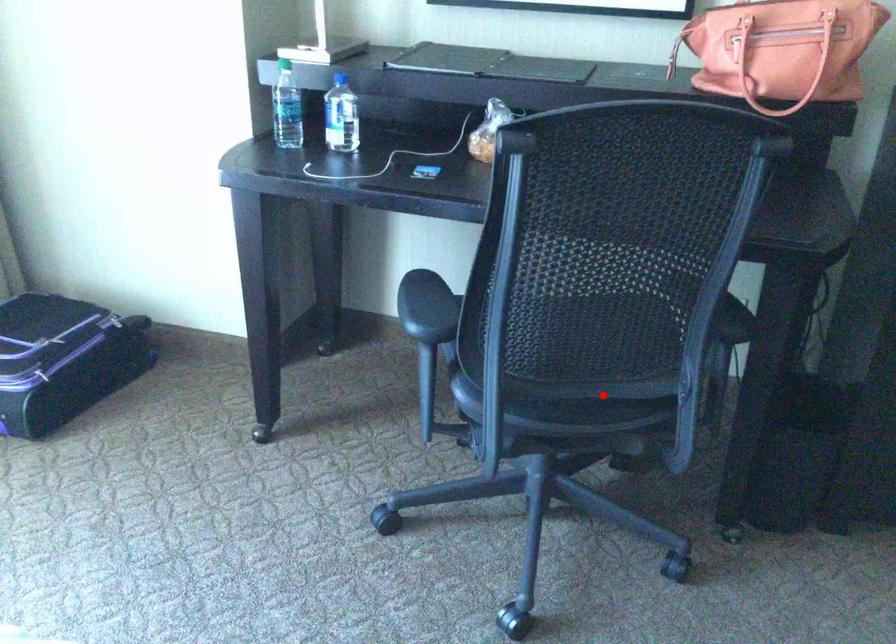
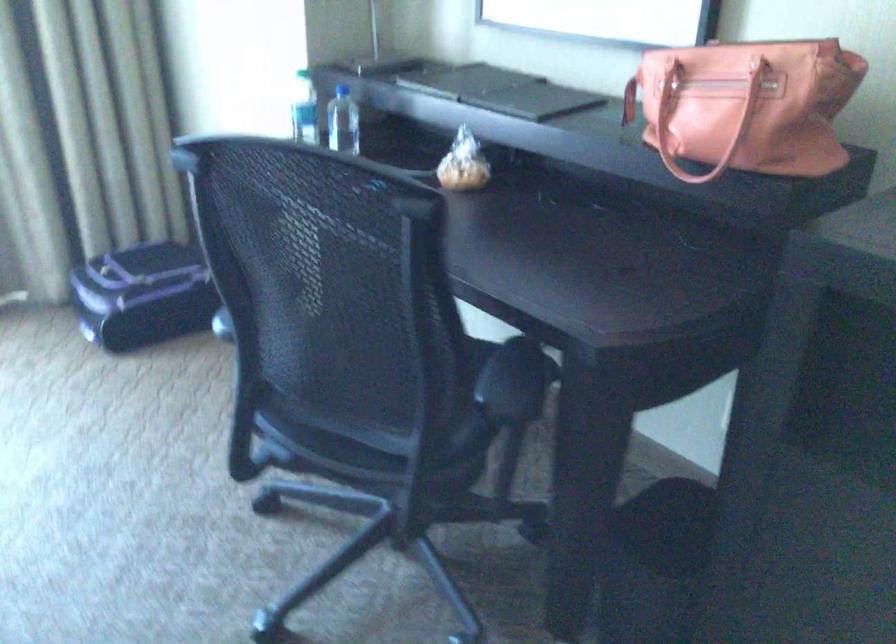
Find the pixel in the second image that matches the highlighted location in the first image.

(364, 440)